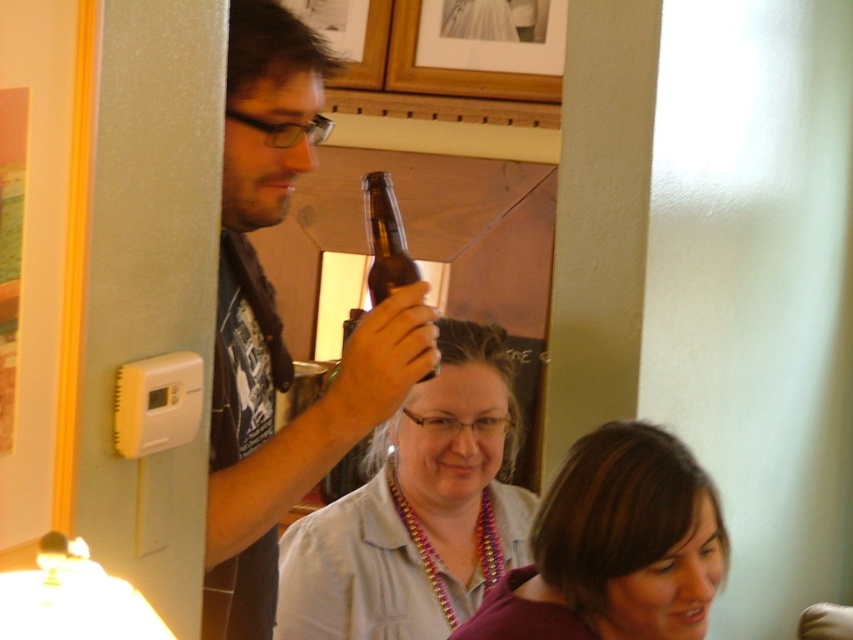
Does point (343, 372) come in front of point (387, 492)?

That is True.

Does matte black shirt at upper left appear on the left side of purple beaded necklace at center?

Correct, you'll find matte black shirt at upper left to the left of purple beaded necklace at center.

Where is `matte black shirt at upper left`? The width and height of the screenshot is (853, 640). matte black shirt at upper left is located at coordinates (280, 324).

The width and height of the screenshot is (853, 640). What do you see at coordinates (416, 509) in the screenshot? I see `purple beaded necklace at center` at bounding box center [416, 509].

Is point (525, 531) behind point (672, 445)?

Yes.

Where is `purple beaded necklace at center`? This screenshot has height=640, width=853. purple beaded necklace at center is located at coordinates (416, 509).

Which is below, matte black shirt at upper left or matte purple shirt at lower center?

Positioned lower is matte purple shirt at lower center.

Who is taller, matte black shirt at upper left or matte purple shirt at lower center?

Standing taller between the two is matte black shirt at upper left.

Is point (289, 58) positioned after point (646, 531)?

No.

This screenshot has width=853, height=640. In order to click on matte black shirt at upper left in this screenshot , I will do [x=280, y=324].